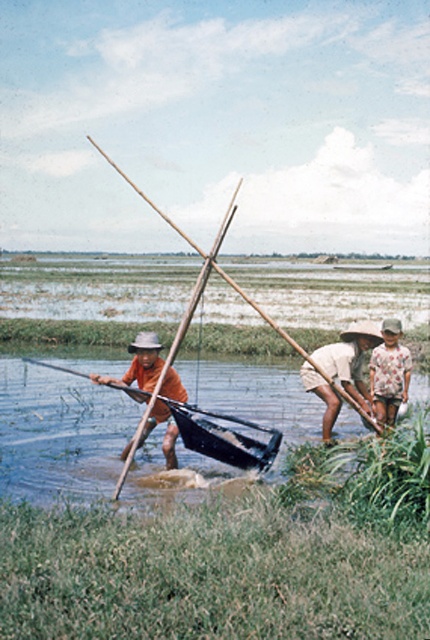
Question: Is black plastic paddle at center below floral fabric shirt at lower right?

Choices:
 (A) no
 (B) yes

Answer: (B)

Question: Which of the following is the closest to the observer?

Choices:
 (A) orange fabric hat at left
 (B) white cotton shirt at lower right
 (C) wooden stick at center
 (D) black plastic paddle at center

Answer: (C)

Question: Which point is farther to the camera?

Choices:
 (A) (270, 452)
 (B) (141, 196)
 (C) (326, 422)
 (D) (163, 381)

Answer: (B)

Question: Does black plastic paddle at center have a lesser width compared to orange fabric hat at left?

Choices:
 (A) no
 (B) yes

Answer: (A)

Question: Can you confirm if black plastic paddle at center is smaller than orange fabric hat at left?

Choices:
 (A) yes
 (B) no

Answer: (B)

Question: Which of the following is the closest to the observer?

Choices:
 (A) (390, 324)
 (B) (243, 444)
 (C) (368, 401)
 (D) (353, 333)

Answer: (D)